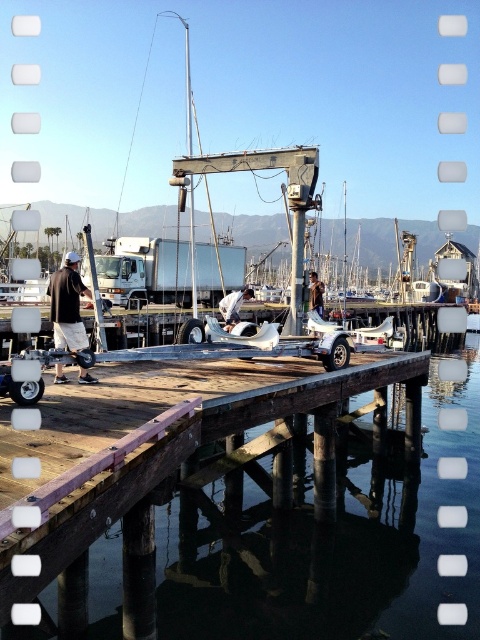
You are standing on the dock and want to know which object is taller between the dark gray shorts at center and the white fabric sailboat at center. Can you determine this based on their positions?

The dark gray shorts at center has a greater height compared to the white fabric sailboat at center, so the dark gray shorts at center is taller.